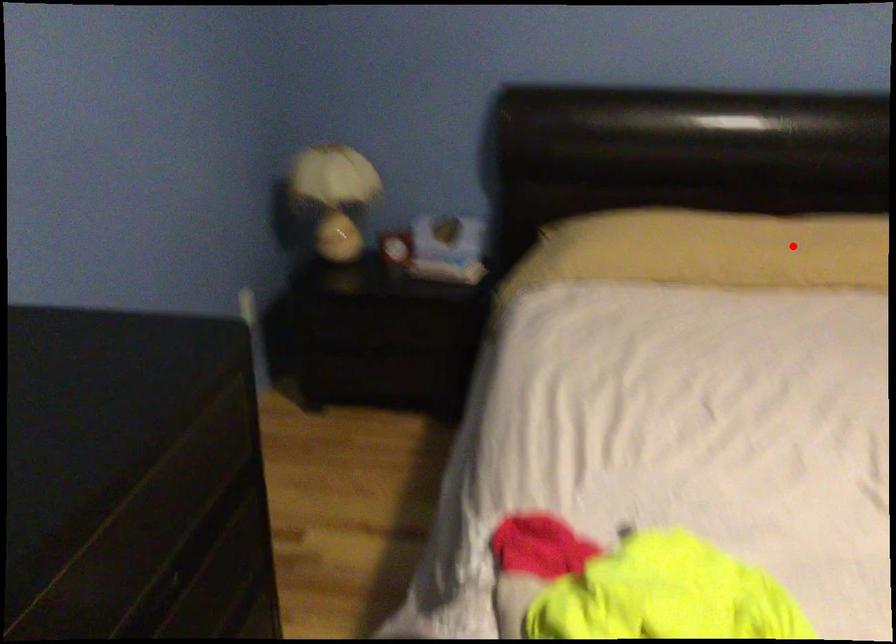
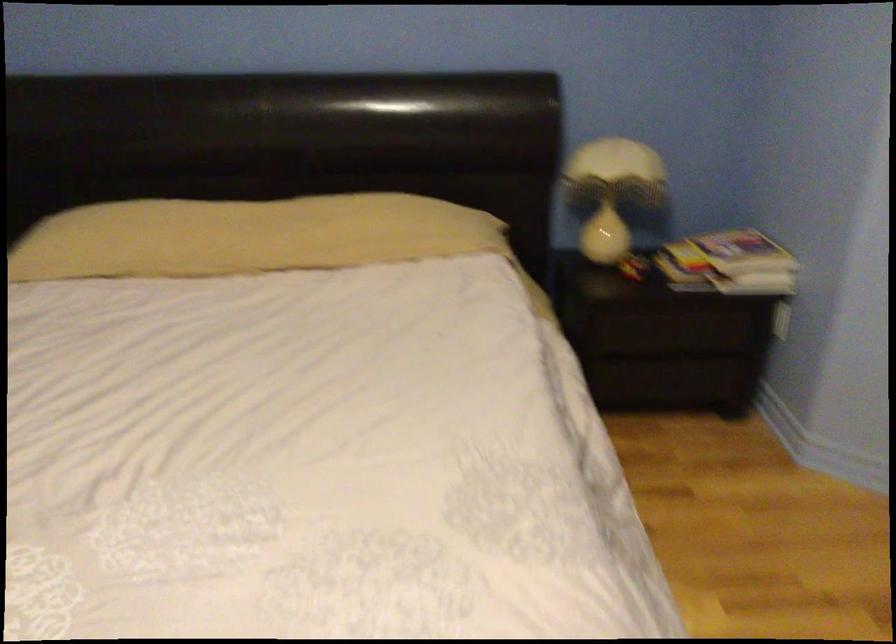
Question: I am providing you with two images of the same scene from different viewpoints. A red point is marked on the first image. At the location where the point appears in image 1, is it still visible in image 2?

Choices:
 (A) Yes
 (B) No

Answer: (A)